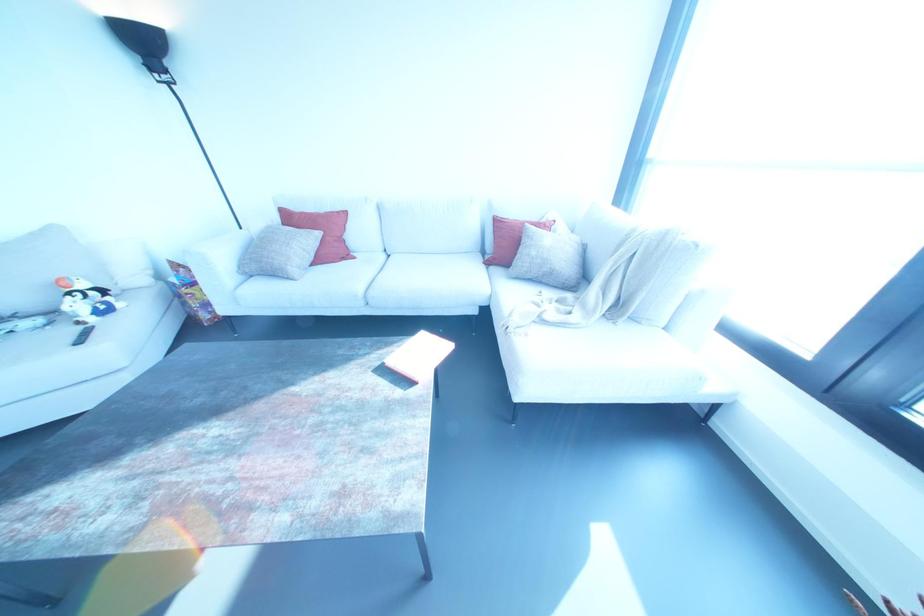
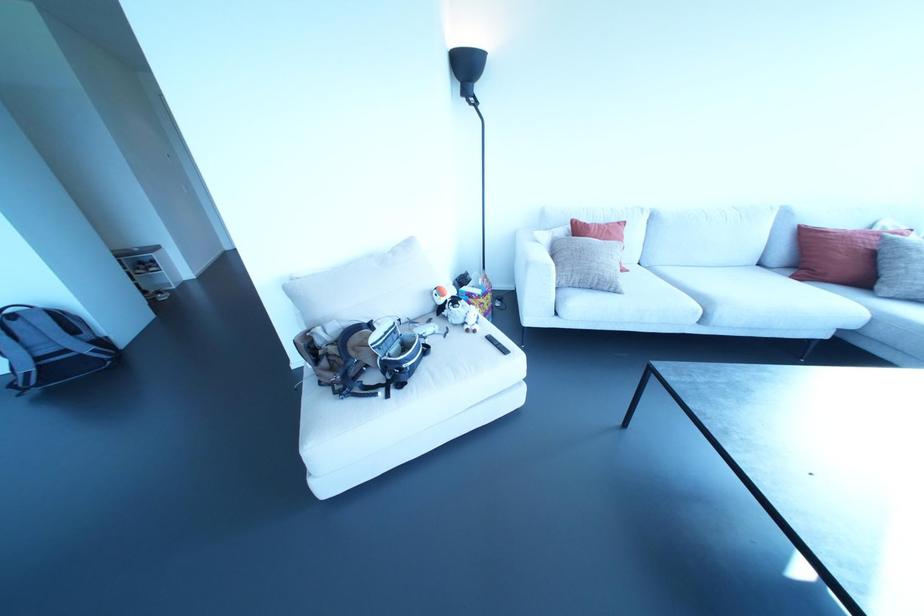
Where in the second image is the point corresponding to (78,322) from the first image?

(467, 330)